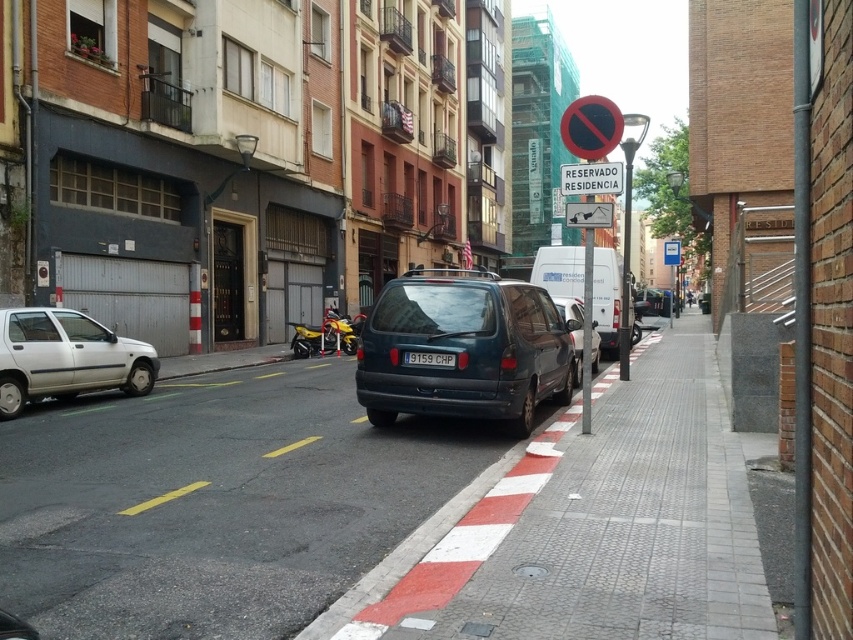
You are a delivery driver who needs to park your van on the street. You see a white plastic sign at center and a black plastic license plate at center. Which object is wider?

The white plastic sign at center is wider than the black plastic license plate at center.